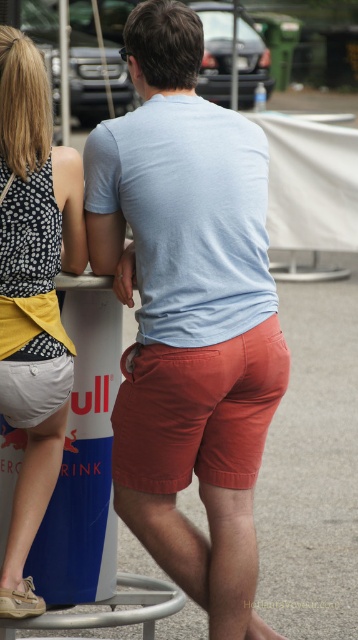
Who is higher up, matte orange shorts at center or metallic pole at upper left?

Positioned higher is metallic pole at upper left.

Is point (249, 484) farther from camera compared to point (61, 76)?

No, (249, 484) is closer to viewer.

You are a GUI agent. You are given a task and a screenshot of the screen. Output one action in this format:
    pyautogui.click(x=<x>, y=<y>)
    Task: Click on the matte orange shorts at center
    
    Given the screenshot: What is the action you would take?
    pyautogui.click(x=197, y=410)

Can you confirm if matte blue t-shirt at center is taller than matte orange shorts at center?

Correct, matte blue t-shirt at center is much taller as matte orange shorts at center.

Locate an element on the screen. matte blue t-shirt at center is located at coordinates (189, 314).

Between point (97, 147) and point (39, 456), which one is positioned in front?

Positioned in front is point (97, 147).

Is point (127, 124) closer to camera compared to point (17, 568)?

Yes, it is.

This screenshot has height=640, width=358. What are the coordinates of `light blue cotton t-shirt at center` in the screenshot? It's located at (187, 216).